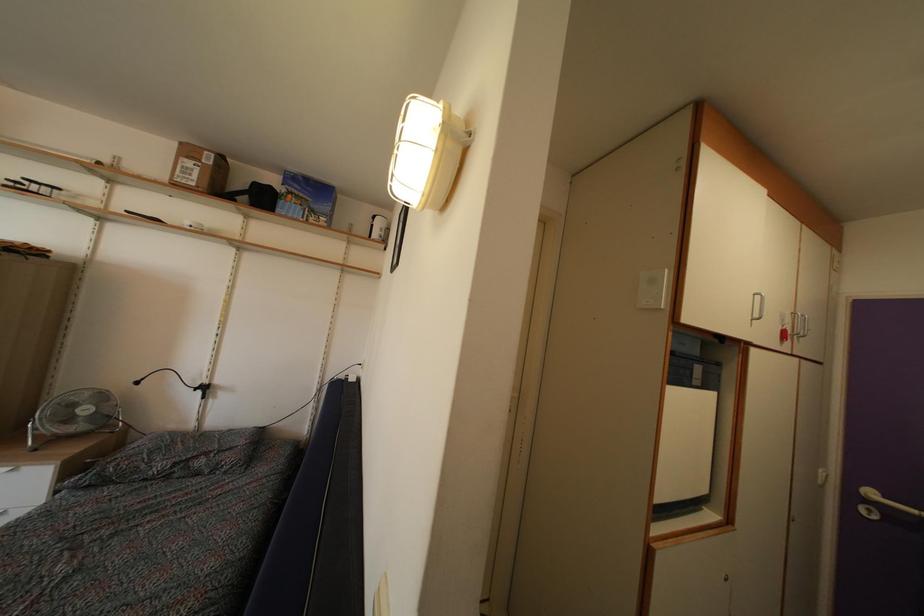
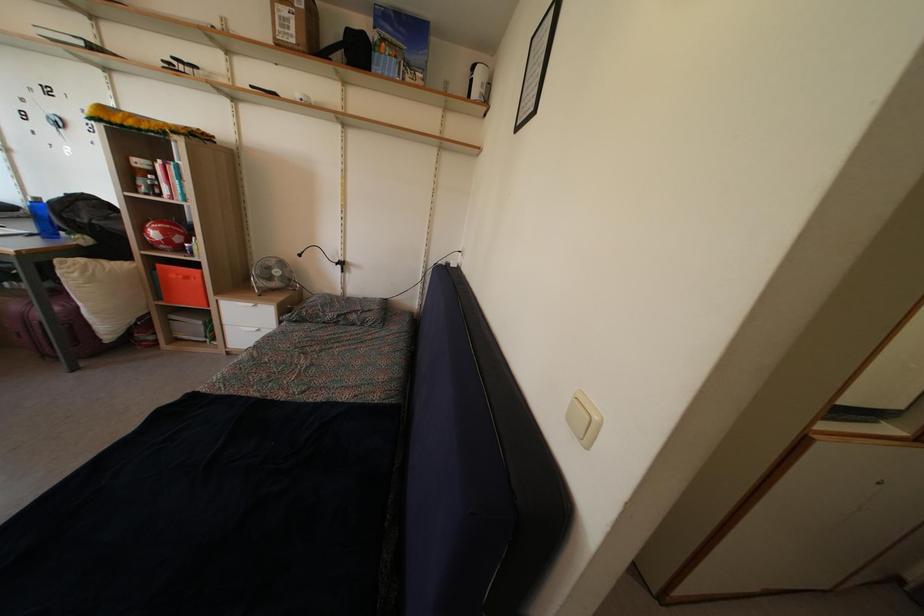
The point at (195, 434) is marked in the first image. Where is the corresponding point in the second image?

(342, 301)